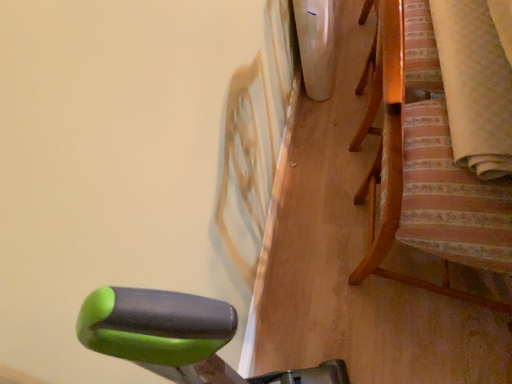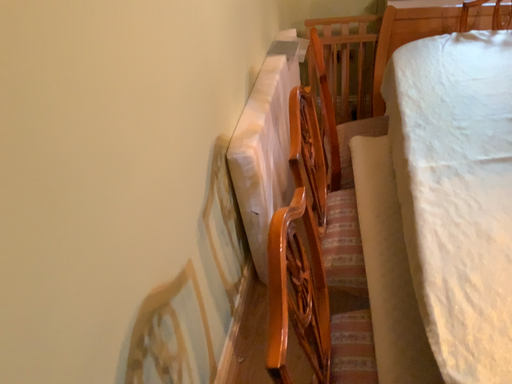
Question: How did the camera likely rotate when shooting the video?

Choices:
 (A) rotated upward
 (B) rotated downward

Answer: (A)